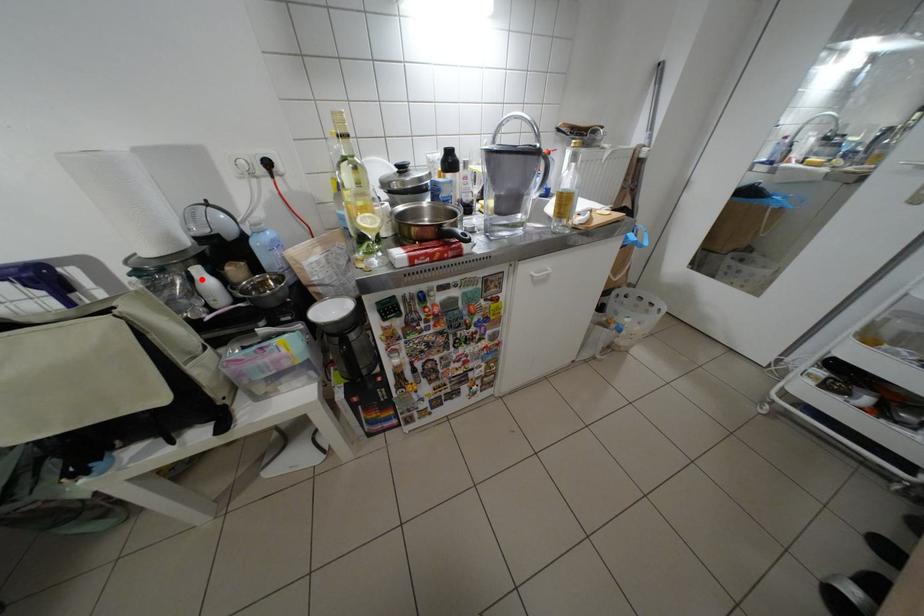
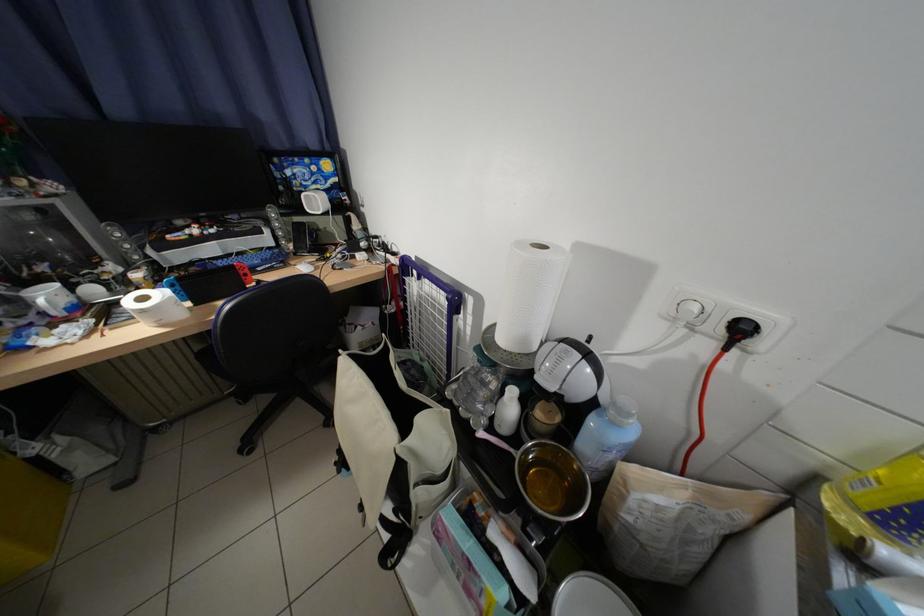
In the second image, find the point that corresponds to the highlighted location in the first image.

(514, 392)